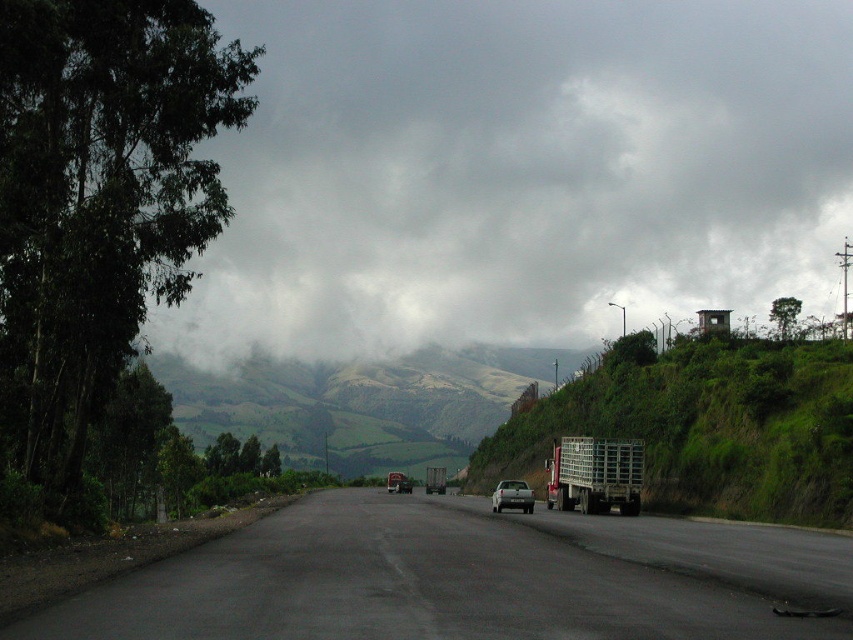
From the picture: You are a drone operator trying to capture a photo of the cloudy sky at upper center and the metallic silver trailer truck at right. Which object appears taller in the image?

The cloudy sky at upper center is taller than the metallic silver trailer truck at right.

You are a delivery driver planning to pass a silver metallic car at center on the asphalt road at center. Considering the road conditions described, can you safely overtake the car without moving off the road?

The asphalt road at center is not as tall as silver metallic car at center, so the driver would have limited visibility when attempting to overtake. This could make it difficult to judge the distance and potential obstacles, so overtaking might not be safe unless there is sufficient clearance and visibility ahead.

You are a driver approaching the intersection ahead. You see a cloudy sky at upper center and a silver metallic car at center. Which object is positioned higher in the image?

The cloudy sky at upper center is located above the silver metallic car at center, so it is positioned higher in the image.